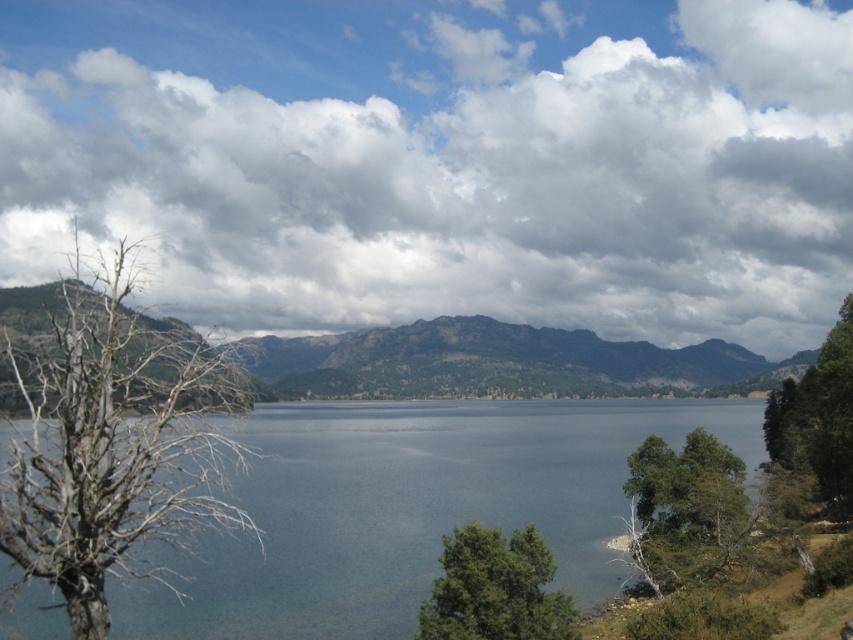
From the picture: You are a bird flying over the lake and want to land on the green leafy tree at lower center. Can you see the cloudy sky at upper center from your landing spot?

Yes, because the cloudy sky at upper center is in front of the green leafy tree at lower center, so the sky would be visible from the tree.

You are planning to paint a landscape scene based on the image. You need to decide which object to paint first so that the larger object can be painted around it. Which object should you paint first, the rugged brown mountain at center or the green leafy tree at lower right?

The rugged brown mountain at center is wider than the green leafy tree at lower right, so you should paint the green leafy tree at lower right first to ensure the larger mountain can be painted around it.